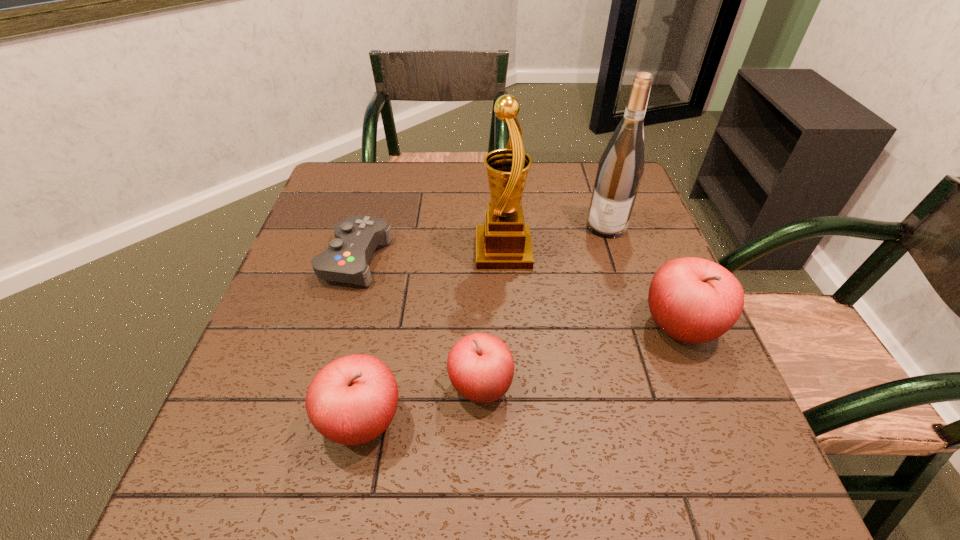
Where is `the second shortest apple`? The image size is (960, 540). the second shortest apple is located at coordinates (352, 400).

The image size is (960, 540). Find the location of `the third shortest object`. the third shortest object is located at coordinates (352, 400).

This screenshot has height=540, width=960. Identify the location of the shortest apple. (480, 366).

Where is `the fifth tallest object`? The width and height of the screenshot is (960, 540). the fifth tallest object is located at coordinates (480, 366).

This screenshot has height=540, width=960. I want to click on the rightmost apple, so click(x=693, y=300).

You are a GUI agent. You are given a task and a screenshot of the screen. Output one action in this format:
    pyautogui.click(x=<x>, y=<y>)
    Task: Click on the control
    
    Given the screenshot: What is the action you would take?
    pyautogui.click(x=346, y=260)

Find the location of a particular element. The image size is (960, 540). award is located at coordinates (504, 242).

Find the location of `wine bottle`. wine bottle is located at coordinates (620, 169).

You are a GUI agent. You are given a task and a screenshot of the screen. Output one action in this format:
    pyautogui.click(x=<x>, y=<y>)
    Task: Click on the vacant space located 0.330m on the back of the leftmost apple
    The height and width of the screenshot is (540, 960).
    Given the screenshot: What is the action you would take?
    pyautogui.click(x=394, y=265)

In order to click on vacant point located 0.200m on the right of the shortest apple in this screenshot , I will do pos(619,386).